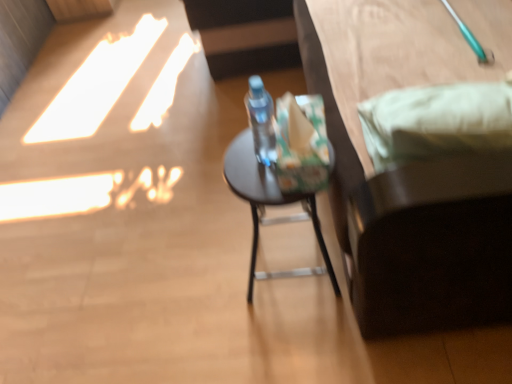
Locate an element on the screen. The width and height of the screenshot is (512, 384). unoccupied area behind matte black stool at center is located at coordinates [260, 213].